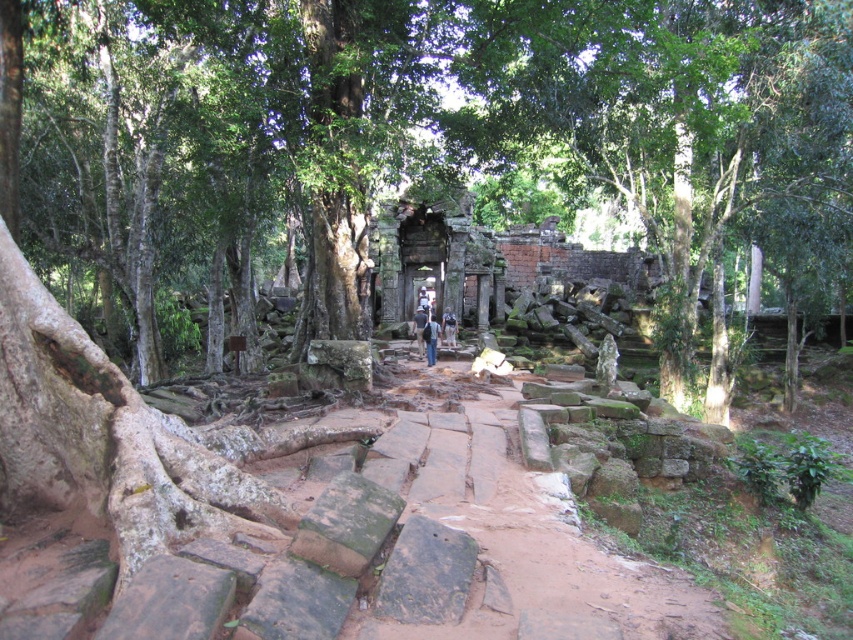
Question: Which object is positioned closest to the blue fabric shirt at center?

Choices:
 (A) dark blue jeans at center
 (B) green rough bark tree at center
 (C) brown leather backpack at center

Answer: (A)

Question: Is green rough bark tree at center bigger than blue fabric shirt at center?

Choices:
 (A) yes
 (B) no

Answer: (A)

Question: Is dark blue jeans at center positioned before brown leather backpack at center?

Choices:
 (A) yes
 (B) no

Answer: (A)

Question: Which object appears farthest from the camera in this image?

Choices:
 (A) green rough bark tree at center
 (B) brown leather backpack at center
 (C) dark blue jeans at center
 (D) blue fabric shirt at center

Answer: (D)

Question: Which point appears closest to the camera in this image?

Choices:
 (A) (688, 353)
 (B) (439, 330)
 (C) (445, 314)
 (D) (422, 314)

Answer: (A)

Question: Does green rough bark tree at center have a larger size compared to dark blue jeans at center?

Choices:
 (A) yes
 (B) no

Answer: (A)